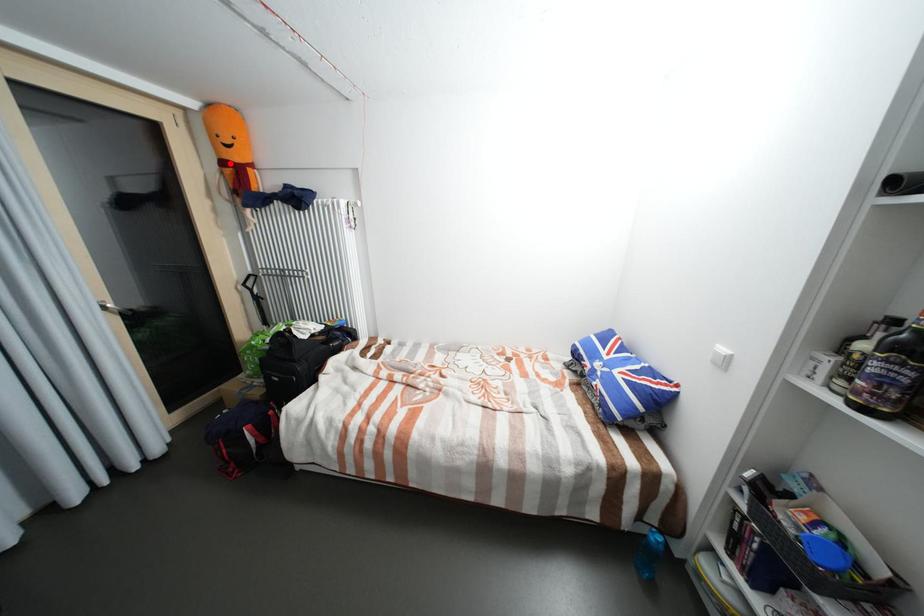
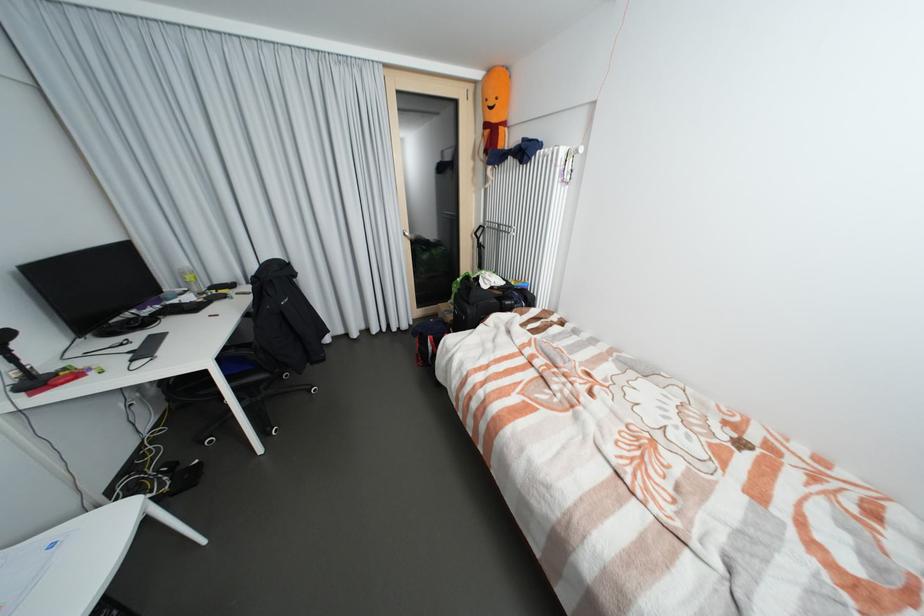
Question: I am providing you with two images of the same scene from different viewpoints. A red point is marked on the first image. At the location where the point appears in image 1, is it still visible in image 2?

Choices:
 (A) Yes
 (B) No

Answer: (A)